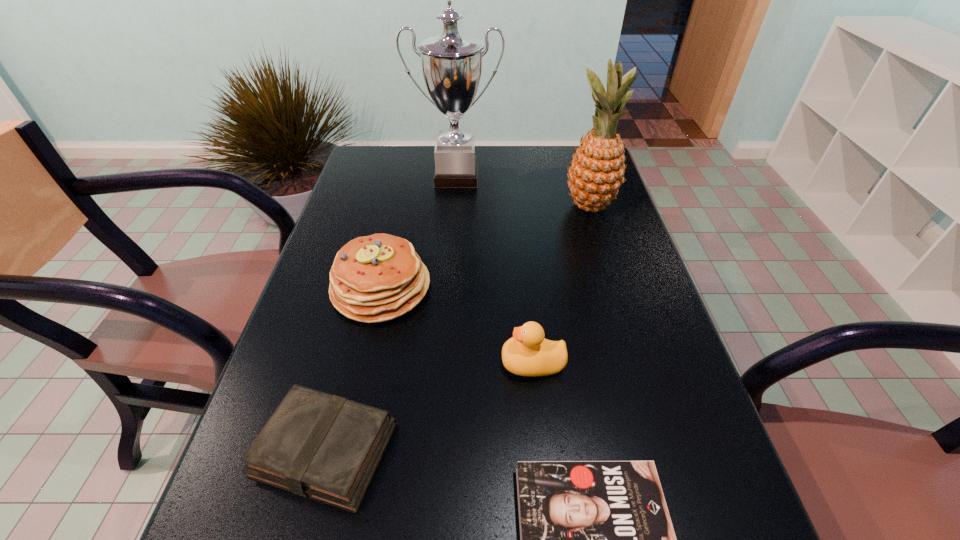
You are a GUI agent. You are given a task and a screenshot of the screen. Output one action in this format:
    pyautogui.click(x=<x>, y=<y>)
    Task: Click on the trophy cup
    The image size is (960, 540).
    Given the screenshot: What is the action you would take?
    pyautogui.click(x=451, y=63)

In order to click on pineapple in this screenshot , I will do `click(596, 173)`.

Find the location of a particular element. the fourth nearest object is located at coordinates [376, 278].

Where is `the third nearest object`? the third nearest object is located at coordinates coord(527,353).

The width and height of the screenshot is (960, 540). Identify the location of the second shortest object. (316, 445).

Find the location of a particular element. The image size is (960, 540). the left book is located at coordinates (316, 445).

What are the coordinates of `vacant space located at the front view of the tallest object` in the screenshot? It's located at (452, 235).

This screenshot has height=540, width=960. I want to click on free location located on the back of the fifth shortest object, so click(577, 165).

The image size is (960, 540). In order to click on blank area located on the right of the pancake in this screenshot , I will do [563, 288].

The width and height of the screenshot is (960, 540). What are the coordinates of `free space located on the face of the duck` in the screenshot? It's located at (386, 363).